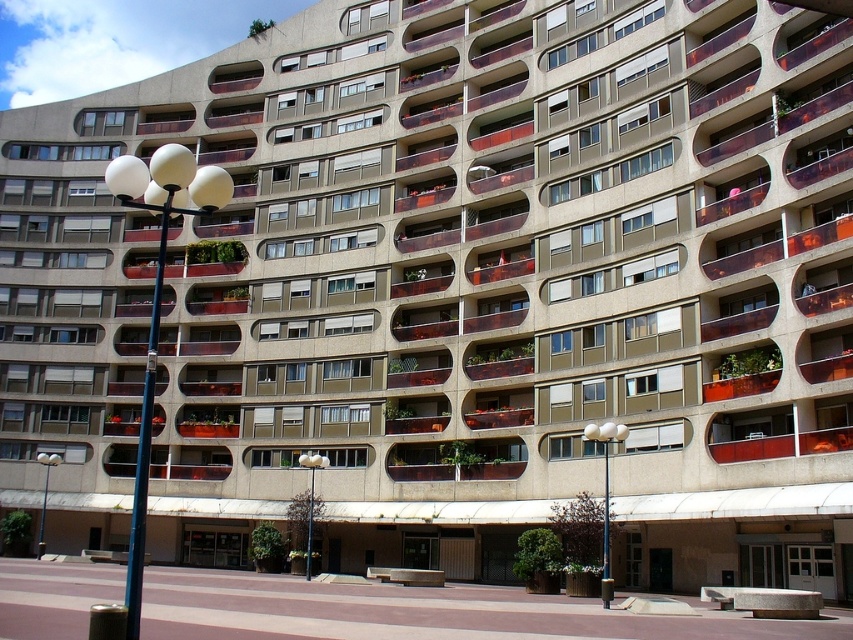
Does white glossy lamp post at left have a lesser height compared to white glossy lamp post at center?

No, white glossy lamp post at left is not shorter than white glossy lamp post at center.

Does white glossy lamp post at left lie behind white glossy lamp post at center?

No.

Is point (132, 490) less distant than point (616, 435)?

No, (132, 490) is further to viewer.

I want to click on white glossy lamp post at left, so click(x=157, y=301).

Which is above, white glossy lamp post at center or metallic streetlight at center?

white glossy lamp post at center is higher up.

Which is in front, point (625, 429) or point (299, 461)?

Positioned in front is point (625, 429).

Does point (583, 429) lie behind point (318, 467)?

No, (583, 429) is in front of (318, 467).

This screenshot has height=640, width=853. In order to click on white glossy lamp post at center in this screenshot , I will do `click(605, 493)`.

How distant is metallic streetlight at center from white glossy lamp post at lower left?

metallic streetlight at center and white glossy lamp post at lower left are 79.16 feet apart from each other.

Who is more forward, (323, 465) or (44, 541)?

Positioned in front is point (323, 465).

Measure the distance between metallic streetlight at center and camera.

metallic streetlight at center is 200.50 feet away from camera.

The height and width of the screenshot is (640, 853). I want to click on metallic streetlight at center, so click(x=311, y=499).